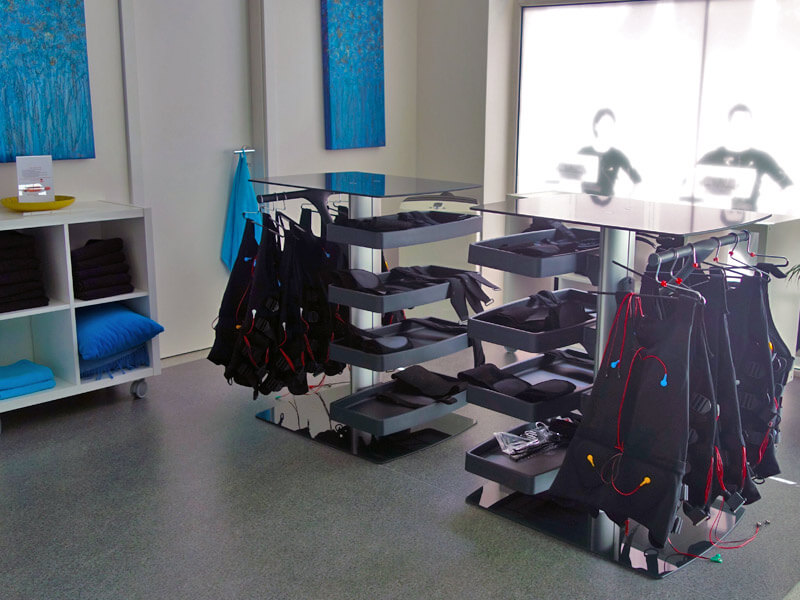
Identify the location of glass. The height and width of the screenshot is (600, 800). (662, 220).